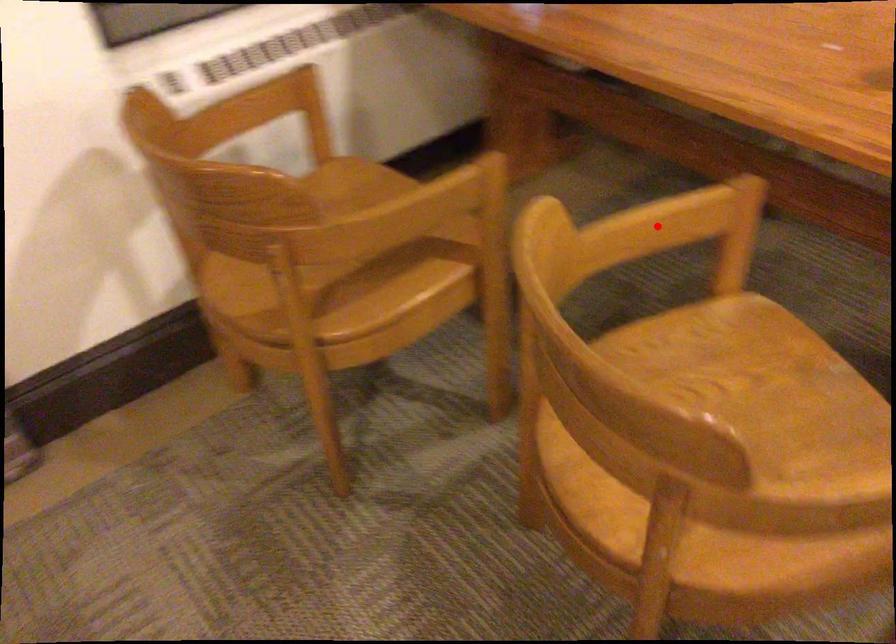
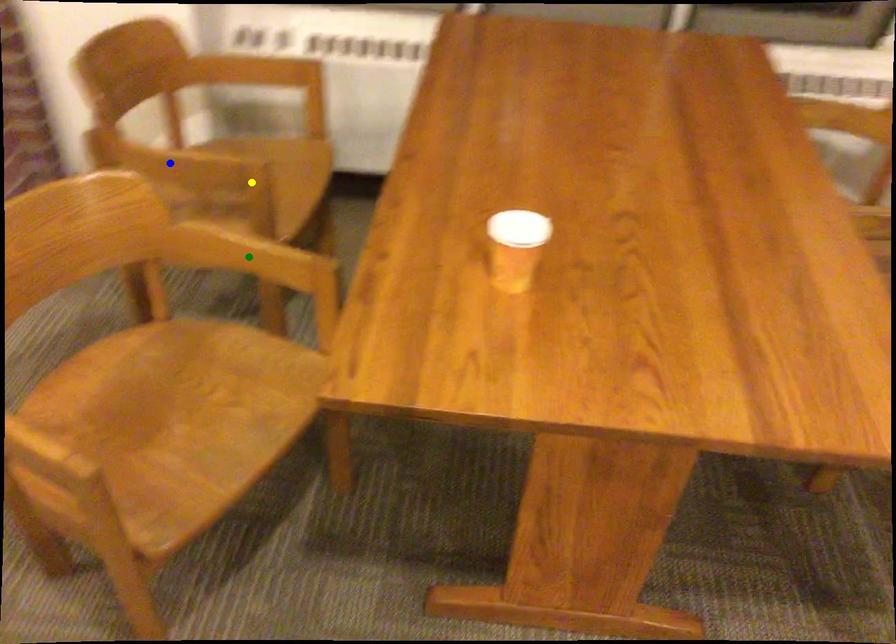
Question: I am providing you with two images of the same scene from different viewpoints. A red point is marked on the first image. You are given multiple points on the second image. In image 2, which mark is for the same physical point as the one in image 1?

Choices:
 (A) green point
 (B) blue point
 (C) yellow point

Answer: (A)